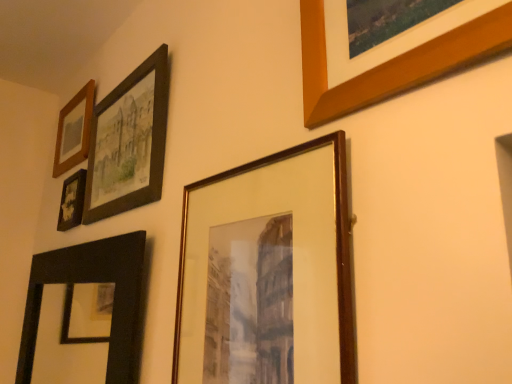
Question: Can we say wooden picture frame at upper right, the 6th picture frame viewed from the left, lies outside wooden frame at upper left, the 6th picture frame positioned from the right?

Choices:
 (A) no
 (B) yes

Answer: (B)

Question: Can you confirm if wooden picture frame at upper right, the 6th picture frame viewed from the left, is smaller than wooden frame at upper left, the 1th picture frame positioned from the left?

Choices:
 (A) no
 (B) yes

Answer: (B)

Question: Can you confirm if wooden picture frame at upper right, the 6th picture frame viewed from the left, is thinner than wooden frame at upper left, the 1th picture frame positioned from the left?

Choices:
 (A) yes
 (B) no

Answer: (A)

Question: Does wooden picture frame at upper right, the 6th picture frame viewed from the left, have a greater height compared to wooden frame at upper left, the 6th picture frame positioned from the right?

Choices:
 (A) yes
 (B) no

Answer: (A)

Question: From the image's perspective, would you say wooden picture frame at upper right, the 6th picture frame viewed from the left, is positioned over wooden frame at upper left, the 6th picture frame positioned from the right?

Choices:
 (A) yes
 (B) no

Answer: (A)

Question: Can you see wooden picture frame at upper right, the first picture frame in the right-to-left sequence, touching wooden frame at upper left, the 6th picture frame positioned from the right?

Choices:
 (A) yes
 (B) no

Answer: (B)

Question: Is black matte mirror at lower left, arranged as the fourth picture frame when viewed from the right, to the right of matte black frame at upper left, the fourth picture frame viewed from the left, from the viewer's perspective?

Choices:
 (A) no
 (B) yes

Answer: (A)

Question: Could matte black frame at upper left, the fourth picture frame viewed from the left, be considered to be inside black matte mirror at lower left, arranged as the fourth picture frame when viewed from the right?

Choices:
 (A) yes
 (B) no

Answer: (B)

Question: From the image's perspective, is black matte mirror at lower left, arranged as the fourth picture frame when viewed from the right, located above matte black frame at upper left, the 3th picture frame from the right?

Choices:
 (A) yes
 (B) no

Answer: (B)

Question: Can you confirm if black matte mirror at lower left, arranged as the fourth picture frame when viewed from the right, is smaller than matte black frame at upper left, the 3th picture frame from the right?

Choices:
 (A) no
 (B) yes

Answer: (A)

Question: From the image's perspective, is black matte mirror at lower left, arranged as the fourth picture frame when viewed from the right, under matte black frame at upper left, the fourth picture frame viewed from the left?

Choices:
 (A) yes
 (B) no

Answer: (A)

Question: Is black matte mirror at lower left, arranged as the fourth picture frame when viewed from the right, directly adjacent to matte black frame at upper left, the fourth picture frame viewed from the left?

Choices:
 (A) yes
 (B) no

Answer: (B)

Question: Considering the relative positions of matte black photo frame at upper left, the 2th picture frame viewed from the left, and wooden frame at upper left, the 6th picture frame positioned from the right, in the image provided, is matte black photo frame at upper left, the 2th picture frame viewed from the left, to the right of wooden frame at upper left, the 6th picture frame positioned from the right, from the viewer's perspective?

Choices:
 (A) yes
 (B) no

Answer: (A)